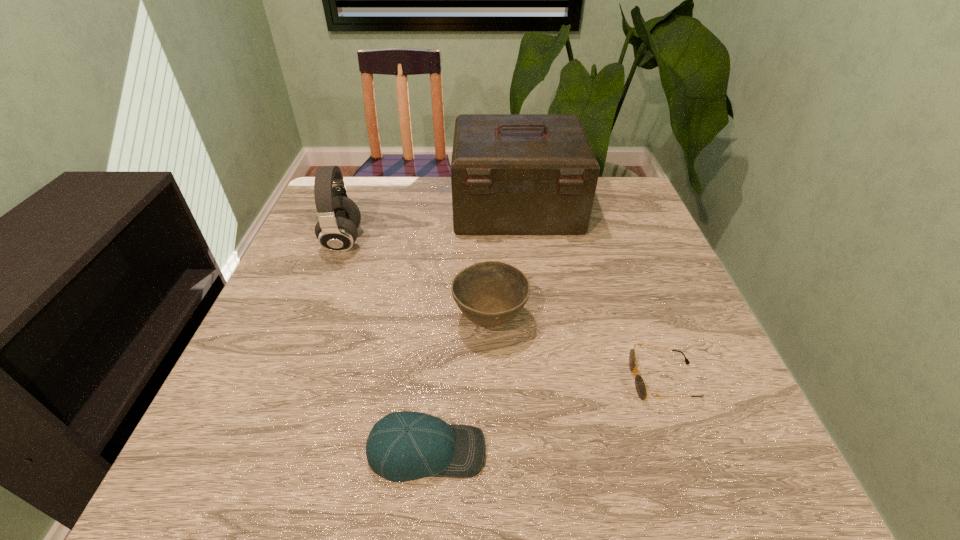
Where is `free region that satisfies the following two spatial constraints: 1. on the ear cups of the fourth shortest object; 2. on the right side of the nearest object`? The width and height of the screenshot is (960, 540). free region that satisfies the following two spatial constraints: 1. on the ear cups of the fourth shortest object; 2. on the right side of the nearest object is located at coordinates (263, 451).

Find the location of a particular element. Image resolution: width=960 pixels, height=540 pixels. blank area in the image that satisfies the following two spatial constraints: 1. on the ear cups of the second shortest object; 2. on the right side of the fourth shortest object is located at coordinates (263, 451).

Identify the location of free space that satisfies the following two spatial constraints: 1. on the back side of the second shortest object; 2. on the left side of the tallest object. The image size is (960, 540). (449, 208).

Find the location of `vacant region that satisfies the following two spatial constraints: 1. on the ear cups of the baseball cap; 2. on the right side of the leftmost object`. vacant region that satisfies the following two spatial constraints: 1. on the ear cups of the baseball cap; 2. on the right side of the leftmost object is located at coordinates (263, 451).